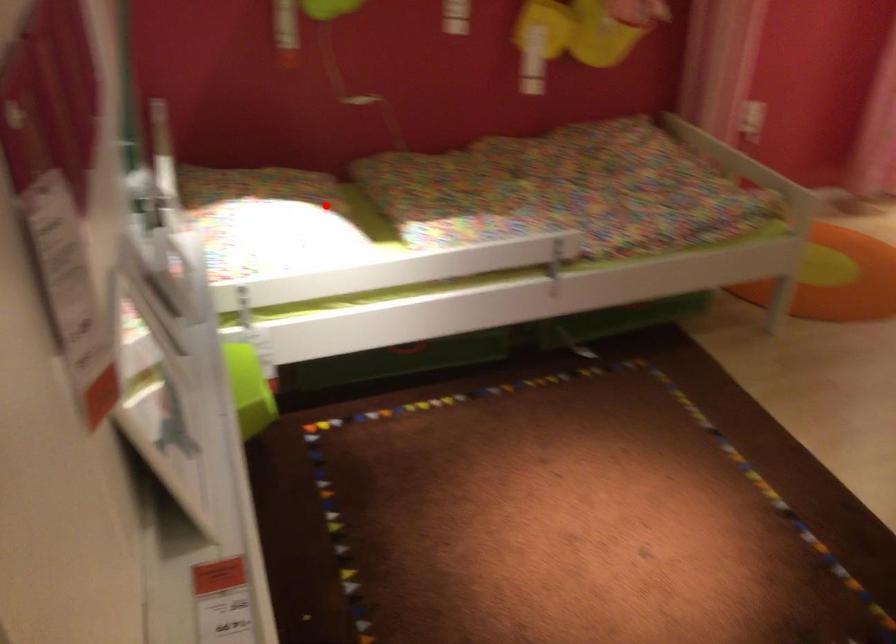
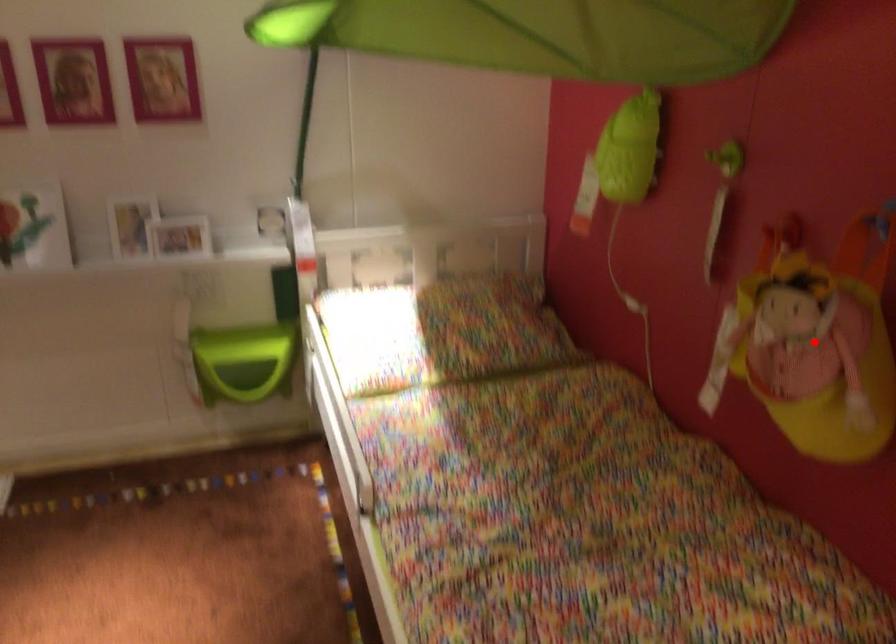
I am providing you with two images of the same scene from different viewpoints. A red point is marked on the first image and another point is marked on the second image. Do the highlighted points in image1 and image2 indicate the same real-world spot?

No